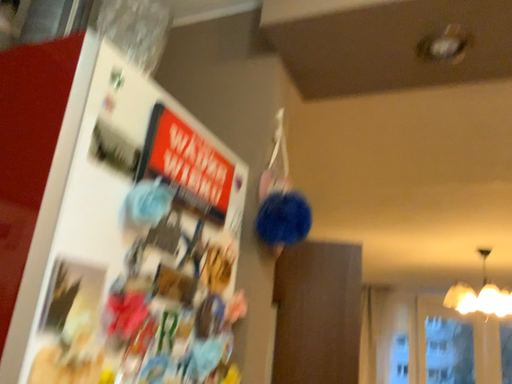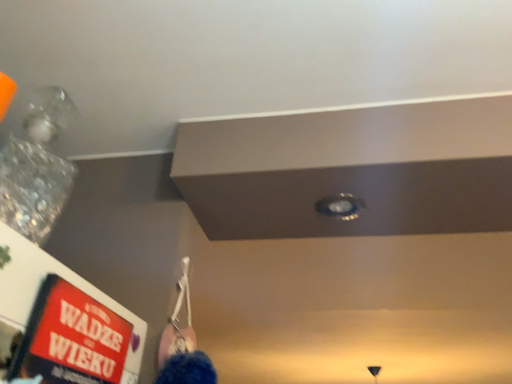
Question: How did the camera likely rotate when shooting the video?

Choices:
 (A) rotated left
 (B) rotated right

Answer: (B)